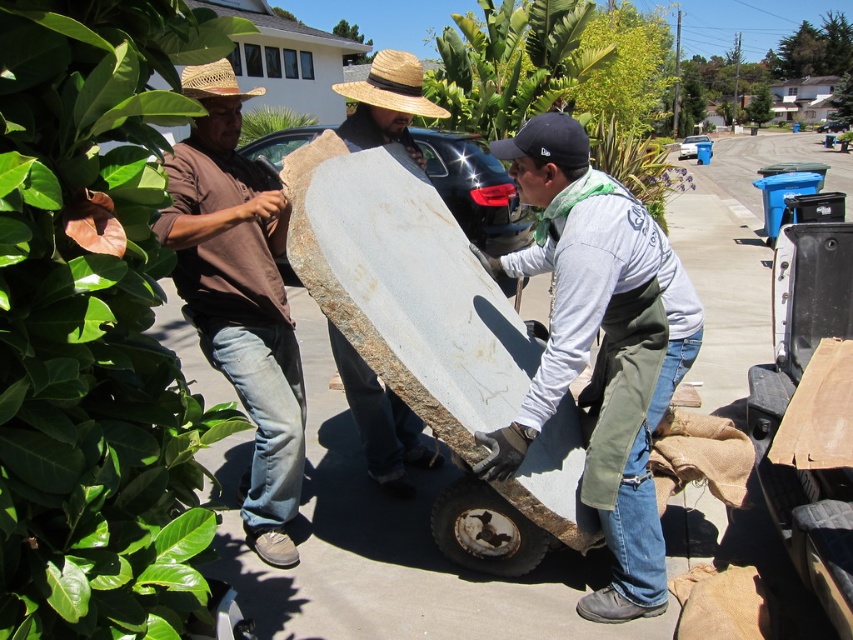
In the scene shown: Based on the scene, can you determine if the matte gray concrete at center is taller than the strawhat at left?

The matte gray concrete at center is much taller than the strawhat at left according to the description.

What are the coordinates of the matte gray concrete at center?

The coordinates of the matte gray concrete at center are 0.541 in the x axis and 0.705 in the y axis.